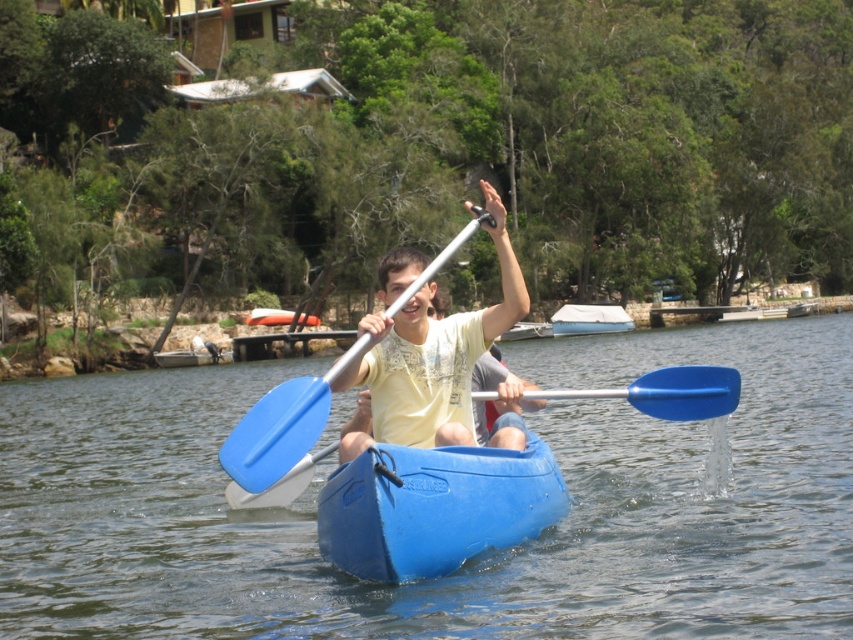
Question: Which point is farther from the camera taking this photo?

Choices:
 (A) (257, 436)
 (B) (456, 316)
 (C) (18, 630)
 (D) (573, 317)

Answer: (D)

Question: In this image, where is blue plastic canoe at center located relative to matte yellow t-shirt at center?

Choices:
 (A) below
 (B) above

Answer: (A)

Question: Which object is the closest to the blue plastic canoe at center?

Choices:
 (A) blue plastic paddle at center
 (B) clear water at center
 (C) matte yellow t-shirt at center

Answer: (C)

Question: Can you confirm if matte yellow t-shirt at center is positioned to the right of white canvas boat at center?

Choices:
 (A) yes
 (B) no

Answer: (B)

Question: Can you confirm if clear water at center is positioned to the left of blue plastic canoe at center?

Choices:
 (A) no
 (B) yes

Answer: (A)

Question: Among these points, which one is farthest from the camera?

Choices:
 (A) (33, 387)
 (B) (604, 314)

Answer: (B)